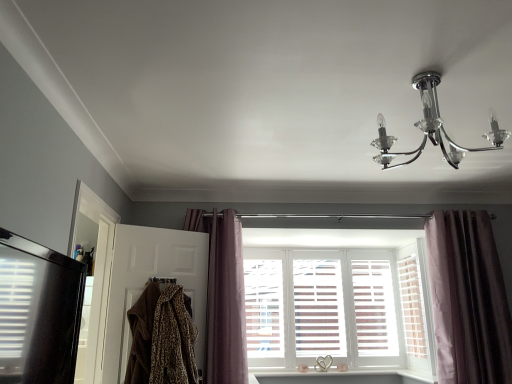
Where is `blank space situated above clear glass chandelier at upper right (from a real-world perspective)`? The width and height of the screenshot is (512, 384). blank space situated above clear glass chandelier at upper right (from a real-world perspective) is located at coordinates (422, 89).